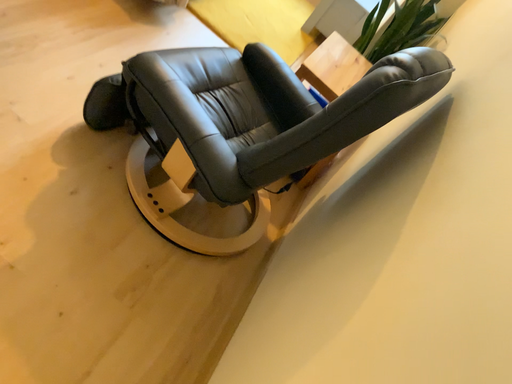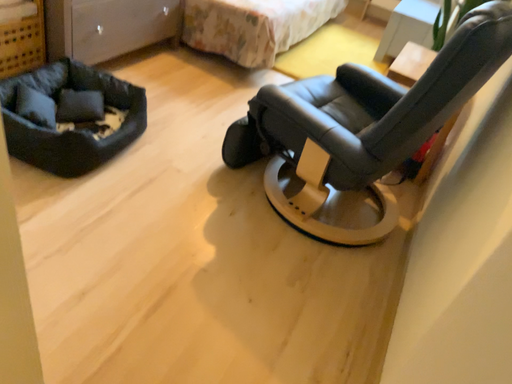
Question: How did the camera likely rotate when shooting the video?

Choices:
 (A) rotated left
 (B) rotated right

Answer: (A)